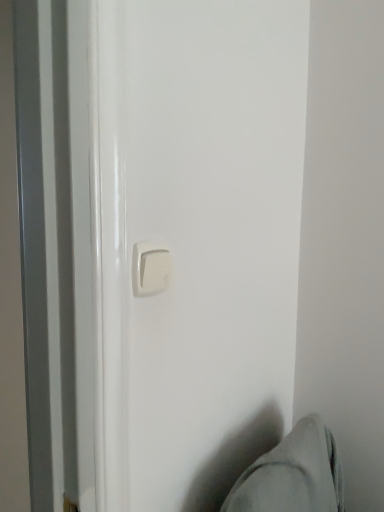
Question: Is white plastic door handle at center positioned with its back to gray fabric swivel chair at lower right?

Choices:
 (A) no
 (B) yes

Answer: (A)

Question: Is white plastic door handle at center at the right side of gray fabric swivel chair at lower right?

Choices:
 (A) no
 (B) yes

Answer: (A)

Question: From a real-world perspective, is white plastic door handle at center beneath gray fabric swivel chair at lower right?

Choices:
 (A) yes
 (B) no

Answer: (B)

Question: Does white plastic door handle at center appear on the left side of gray fabric swivel chair at lower right?

Choices:
 (A) yes
 (B) no

Answer: (A)

Question: Is white plastic door handle at center closer to the viewer compared to gray fabric swivel chair at lower right?

Choices:
 (A) yes
 (B) no

Answer: (B)

Question: From the image's perspective, does white plastic door handle at center appear higher than gray fabric swivel chair at lower right?

Choices:
 (A) no
 (B) yes

Answer: (B)

Question: Does gray fabric swivel chair at lower right appear on the right side of white plastic door handle at center?

Choices:
 (A) yes
 (B) no

Answer: (A)

Question: From the image's perspective, is gray fabric swivel chair at lower right above white plastic door handle at center?

Choices:
 (A) no
 (B) yes

Answer: (A)

Question: Is the position of gray fabric swivel chair at lower right more distant than that of white plastic door handle at center?

Choices:
 (A) yes
 (B) no

Answer: (B)

Question: Considering the relative sizes of gray fabric swivel chair at lower right and white plastic door handle at center in the image provided, is gray fabric swivel chair at lower right smaller than white plastic door handle at center?

Choices:
 (A) yes
 (B) no

Answer: (B)

Question: Is gray fabric swivel chair at lower right looking in the opposite direction of white plastic door handle at center?

Choices:
 (A) yes
 (B) no

Answer: (B)

Question: From a real-world perspective, is gray fabric swivel chair at lower right physically above white plastic door handle at center?

Choices:
 (A) no
 (B) yes

Answer: (A)

Question: Based on their positions, is white plastic door handle at center located to the left or right of gray fabric swivel chair at lower right?

Choices:
 (A) right
 (B) left

Answer: (B)